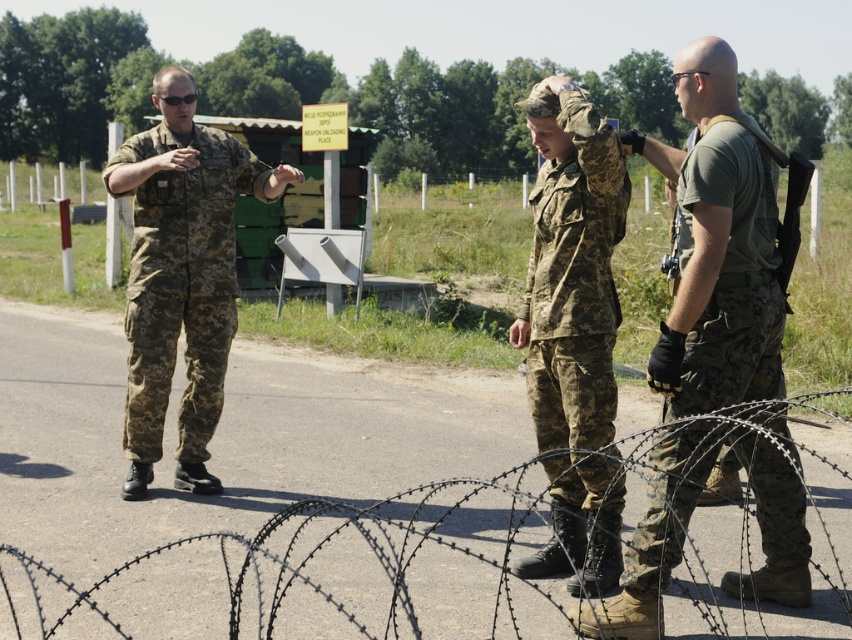
Question: Is barbed wire at center behind camouflage uniform at center?

Choices:
 (A) no
 (B) yes

Answer: (A)

Question: Which object is positioned farthest from the camouflage fabric uniform at center?

Choices:
 (A) barbed wire at center
 (B) camouflage fabric uniform at left
 (C) camouflage uniform at center

Answer: (B)

Question: Is barbed wire at center wider than camouflage fabric uniform at center?

Choices:
 (A) no
 (B) yes

Answer: (B)

Question: Is camouflage uniform at center above camouflage fabric uniform at left?

Choices:
 (A) no
 (B) yes

Answer: (B)

Question: Which object is closer to the camera taking this photo?

Choices:
 (A) barbed wire at center
 (B) camouflage uniform at center
 (C) camouflage fabric uniform at left
 (D) camouflage fabric uniform at center

Answer: (A)

Question: Which of the following is the closest to the observer?

Choices:
 (A) (196, 148)
 (B) (729, 349)
 (C) (815, 612)
 (D) (563, 195)

Answer: (B)